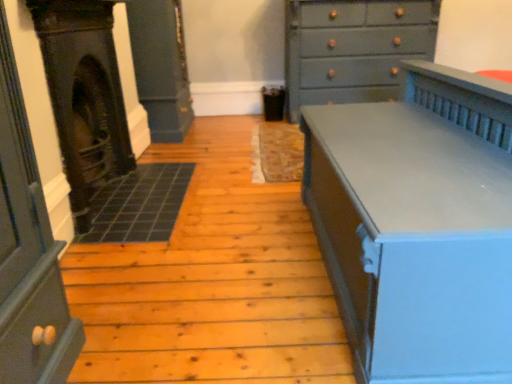
Question: From a real-world perspective, is matte gray chest of drawers at upper right, which ranks as the first chest of drawers in back-to-front order, on dark gray stone fireplace at left?

Choices:
 (A) yes
 (B) no

Answer: (A)

Question: Can you confirm if matte gray chest of drawers at upper right, which ranks as the first chest of drawers in back-to-front order, is bigger than dark gray stone fireplace at left?

Choices:
 (A) no
 (B) yes

Answer: (B)

Question: Is dark gray stone fireplace at left at the back of matte gray chest of drawers at upper right, which is counted as the 2th chest of drawers, starting from the front?

Choices:
 (A) no
 (B) yes

Answer: (A)

Question: Is matte gray chest of drawers at upper right, which is counted as the 2th chest of drawers, starting from the front, far from dark gray stone fireplace at left?

Choices:
 (A) yes
 (B) no

Answer: (A)

Question: From a real-world perspective, is matte gray chest of drawers at upper right, which is counted as the 2th chest of drawers, starting from the front, under dark gray stone fireplace at left?

Choices:
 (A) yes
 (B) no

Answer: (B)

Question: From a real-world perspective, relative to matte gray chest of drawers at upper right, which is counted as the 2th chest of drawers, starting from the front, is dark gray stone fireplace at left vertically above or below?

Choices:
 (A) below
 (B) above

Answer: (A)

Question: From their relative heights in the image, would you say dark gray stone fireplace at left is taller or shorter than matte gray chest of drawers at upper right, positioned as the 2th chest of drawers in bottom-to-top order?

Choices:
 (A) tall
 (B) short

Answer: (B)

Question: Is point (73, 69) positioned closer to the camera than point (333, 36)?

Choices:
 (A) farther
 (B) closer

Answer: (B)

Question: Considering the relative positions of dark gray stone fireplace at left and matte gray chest of drawers at upper right, which ranks as the first chest of drawers in back-to-front order, in the image provided, is dark gray stone fireplace at left to the left or to the right of matte gray chest of drawers at upper right, which ranks as the first chest of drawers in back-to-front order,?

Choices:
 (A) left
 (B) right

Answer: (A)

Question: Considering the relative positions of matte gray chest of drawers at upper right, positioned as the 2th chest of drawers in bottom-to-top order, and dark gray stone fireplace at left in the image provided, is matte gray chest of drawers at upper right, positioned as the 2th chest of drawers in bottom-to-top order, to the left or to the right of dark gray stone fireplace at left?

Choices:
 (A) right
 (B) left

Answer: (A)

Question: In terms of height, does matte gray chest of drawers at upper right, which is counted as the 2th chest of drawers, starting from the front, look taller or shorter compared to dark gray stone fireplace at left?

Choices:
 (A) short
 (B) tall

Answer: (B)

Question: From the image's perspective, is matte gray chest of drawers at upper right, which is counted as the 2th chest of drawers, starting from the front, positioned above or below dark gray stone fireplace at left?

Choices:
 (A) below
 (B) above

Answer: (B)

Question: Considering their positions, is matte gray chest of drawers at upper right, which ranks as the first chest of drawers in back-to-front order, located in front of or behind dark gray stone fireplace at left?

Choices:
 (A) front
 (B) behind

Answer: (B)

Question: Considering the positions of dark gray stone fireplace at left and matte gray chest of drawers at right, placed as the 1th chest of drawers when sorted from bottom to top, in the image, is dark gray stone fireplace at left taller or shorter than matte gray chest of drawers at right, placed as the 1th chest of drawers when sorted from bottom to top,?

Choices:
 (A) short
 (B) tall

Answer: (B)

Question: Does point (96, 72) appear closer or farther from the camera than point (376, 119)?

Choices:
 (A) farther
 (B) closer

Answer: (A)